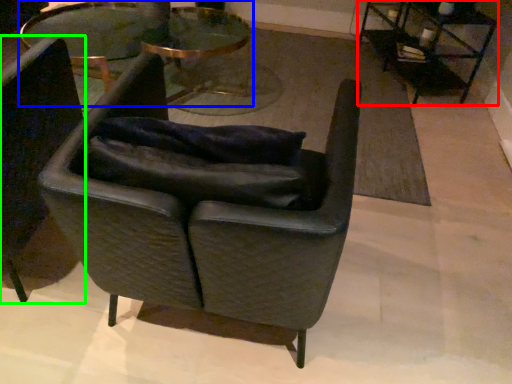
Question: Estimate the real-world distances between objects in this image. Which object is farther from table (highlighted by a red box), table (highlighted by a blue box) or chair (highlighted by a green box)?

Choices:
 (A) table
 (B) chair

Answer: (B)